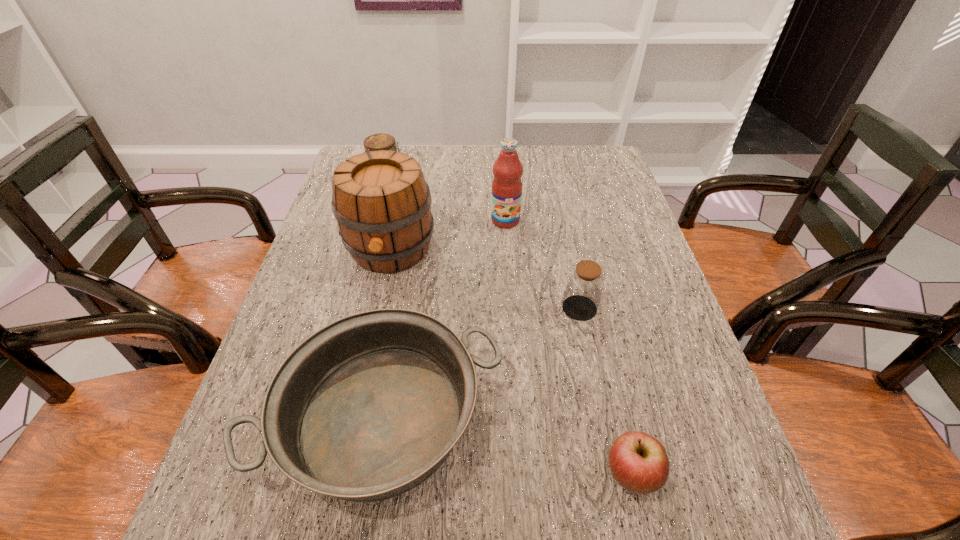
This screenshot has width=960, height=540. Find the location of `object that is at the far left corner`. object that is at the far left corner is located at coordinates (381, 141).

Find the location of a particular element. The height and width of the screenshot is (540, 960). object situated at the near left corner is located at coordinates (365, 409).

In the image, there is a desktop. Where is `vacant space at the far edge`? vacant space at the far edge is located at coordinates (530, 161).

Find the location of a particular element. vacant space at the left edge of the desktop is located at coordinates (308, 259).

I want to click on free space at the right edge of the desktop, so click(636, 235).

I want to click on vacant space at the far right corner, so click(x=612, y=161).

What are the coordinates of `empty space between the left jar and the right jar` in the screenshot? It's located at (484, 244).

You are a GUI agent. You are given a task and a screenshot of the screen. Output one action in this format:
    pyautogui.click(x=<x>, y=<y>)
    Task: Click on the vacant area between the fruit juice and the apple
    The width and height of the screenshot is (960, 540).
    Given the screenshot: What is the action you would take?
    pyautogui.click(x=567, y=348)

At what (x,y) coordinates should I click in order to perform the action: click on unoccupied position between the apple and the left jar. Please return your answer as a coordinate pair (x, y). The height and width of the screenshot is (540, 960). Looking at the image, I should click on (509, 328).

The image size is (960, 540). Identify the location of free area in between the cider and the apple. (511, 363).